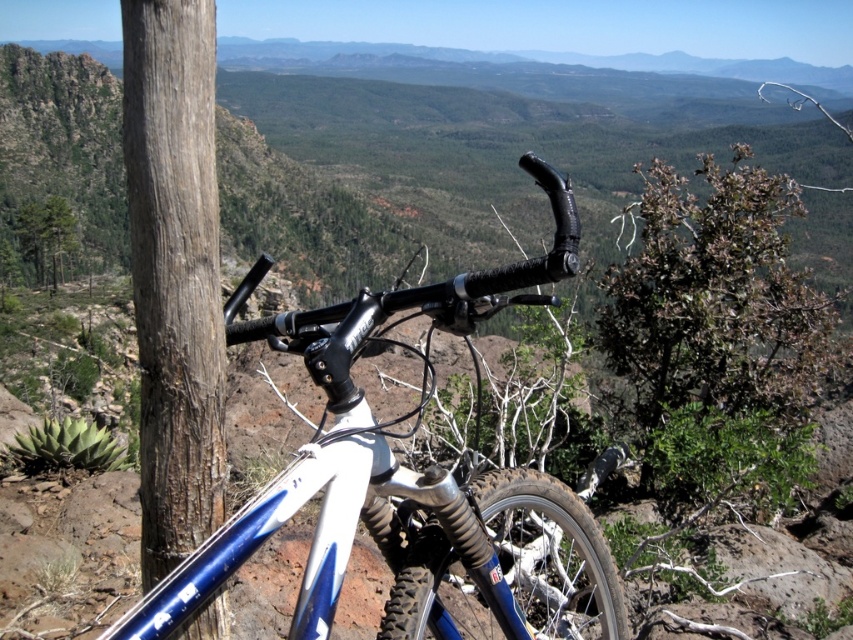
Question: Which point is farther from the camera taking this photo?

Choices:
 (A) (576, 509)
 (B) (206, 196)

Answer: (A)

Question: Which object is closer to the camera taking this photo?

Choices:
 (A) smooth brown wood at left
 (B) blue matte bicycle handlebars at center

Answer: (B)

Question: Does blue matte bicycle handlebars at center lie in front of smooth brown wood at left?

Choices:
 (A) no
 (B) yes

Answer: (B)

Question: Is blue matte bicycle handlebars at center smaller than smooth brown wood at left?

Choices:
 (A) yes
 (B) no

Answer: (B)

Question: Where is blue matte bicycle handlebars at center located in relation to smooth brown wood at left in the image?

Choices:
 (A) below
 (B) above

Answer: (A)